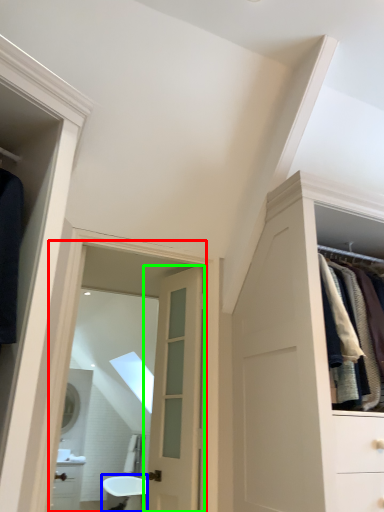
Question: Which object is positioned closest to mirror (highlighted by a red box)? Select from bath (highlighted by a blue box) and door (highlighted by a green box).

Choices:
 (A) bath
 (B) door

Answer: (B)